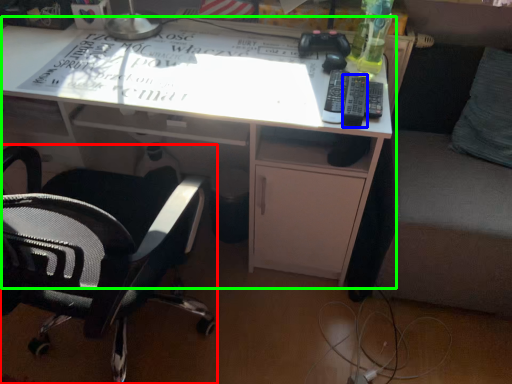
Question: Based on their relative distances, which object is nearer to chair (highlighted by a red box)? Choose from remote (highlighted by a blue box) and desk (highlighted by a green box).

Choices:
 (A) remote
 (B) desk

Answer: (B)